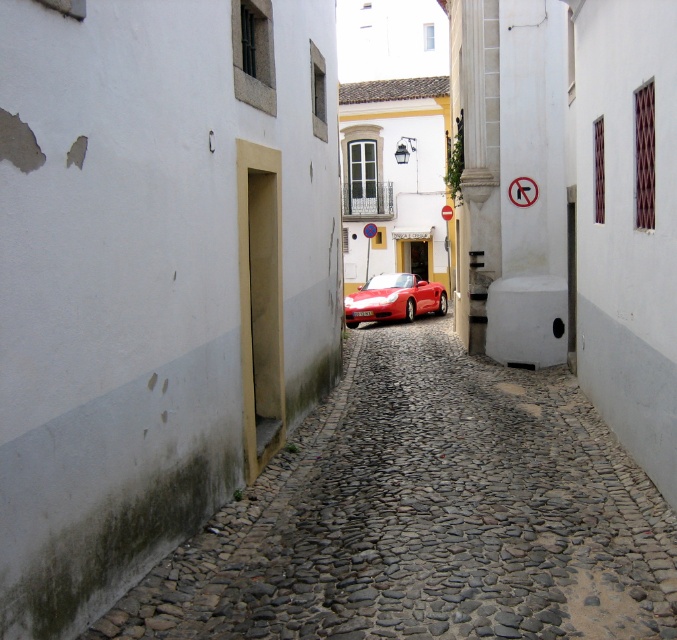
In the scene shown: You are driving a shiny red convertible at center and want to park it in the smooth cobblestone alley at center. Based on the scene, can the alley accommodate the car?

The smooth cobblestone alley at center is wider than the shiny red convertible at center, so yes, the alley can accommodate the car.

You are driving a shiny red convertible at center and want to park it under the metallic circular sign at center. Is this possible given their current positions?

The shiny red convertible at center is already positioned under the metallic circular sign at center, so it is possible to park there.

You are standing on the smooth cobblestone alley at center and want to look at the shiny red convertible at center. Which direction should you look to see it?

Since the smooth cobblestone alley at center is closer to the viewer than the shiny red convertible at center, you would need to look forward or ahead to see the shiny red convertible at center as it is positioned further away in the same line of sight.